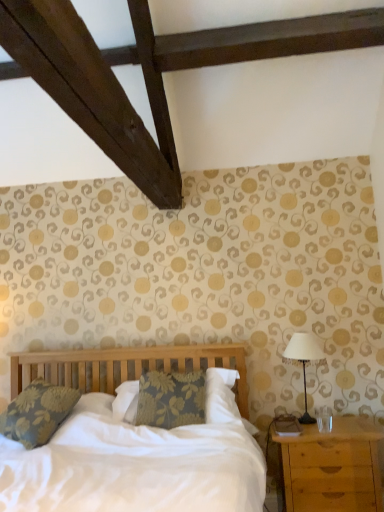
The height and width of the screenshot is (512, 384). What do you see at coordinates (37, 412) in the screenshot?
I see `floral fabric pillow at left` at bounding box center [37, 412].

What do you see at coordinates (332, 467) in the screenshot?
I see `light brown wooden nightstand at lower right` at bounding box center [332, 467].

Measure the distance between point [314,344] and camera.

They are 2.78 meters apart.

Identify the location of floral fabric pillow at left. (37, 412).

Considering the sizes of objects metallic silver table lamp at right and light brown wooden nightstand at lower right in the image provided, who is taller, metallic silver table lamp at right or light brown wooden nightstand at lower right?

light brown wooden nightstand at lower right is taller.

Considering the points (300, 361) and (341, 421), which point is behind, point (300, 361) or point (341, 421)?

Positioned behind is point (300, 361).

Find the location of a particular element. table lamp that appears above the light brown wooden nightstand at lower right (from the image's perspective) is located at coordinates pos(304,361).

From the image's perspective, which one is positioned lower, metallic silver table lamp at right or light brown wooden nightstand at lower right?

light brown wooden nightstand at lower right is shown below in the image.

Is light brown wooden nightstand at lower right located outside metallic silver table lamp at right?

Yes, light brown wooden nightstand at lower right is outside of metallic silver table lamp at right.

How different are the orientations of light brown wooden nightstand at lower right and metallic silver table lamp at right in degrees?

There is a 0.507-degree angle between the facing directions of light brown wooden nightstand at lower right and metallic silver table lamp at right.

From the image's perspective, who appears lower, light brown wooden nightstand at lower right or metallic silver table lamp at right?

light brown wooden nightstand at lower right.

Based on the photo, from a real-world perspective, is metallic silver table lamp at right over floral fabric pillow at left?

Yes, from a real-world perspective, metallic silver table lamp at right is on top of floral fabric pillow at left.

Considering the positions of points (295, 333) and (69, 408), is point (295, 333) closer to camera compared to point (69, 408)?

No, it is not.

Image resolution: width=384 pixels, height=512 pixels. What are the coordinates of `pillow on the left of metallic silver table lamp at right` in the screenshot? It's located at (37, 412).

From the image's perspective, between metallic silver table lamp at right and floral fabric pillow at left, which one is located above?

metallic silver table lamp at right appears higher in the image.

From a real-world perspective, is floral fabric pillow at left below metallic silver table lamp at right?

Indeed, from a real-world perspective, floral fabric pillow at left is positioned beneath metallic silver table lamp at right.

Find the location of a particular element. table lamp located above the floral fabric pillow at left (from a real-world perspective) is located at coordinates (304, 361).

Is floral fabric pillow at left facing towards metallic silver table lamp at right?

No, floral fabric pillow at left is not facing towards metallic silver table lamp at right.

Does floral fabric pillow at left lie behind metallic silver table lamp at right?

No, floral fabric pillow at left is closer to the camera.

Considering the sizes of floral fabric pillow at left and light brown wooden nightstand at lower right in the image, is floral fabric pillow at left bigger or smaller than light brown wooden nightstand at lower right?

Considering their sizes, floral fabric pillow at left takes up less space than light brown wooden nightstand at lower right.

Does point (48, 420) come behind point (377, 493)?

Yes, it is.

Is there a large distance between floral fabric pillow at left and light brown wooden nightstand at lower right?

Indeed, floral fabric pillow at left is not near light brown wooden nightstand at lower right.

From the image's perspective, is light brown wooden nightstand at lower right above or below floral fabric pillow at left?

From the image's perspective, light brown wooden nightstand at lower right appears below floral fabric pillow at left.

Is light brown wooden nightstand at lower right situated inside floral fabric pillow at left or outside?

light brown wooden nightstand at lower right is not enclosed by floral fabric pillow at left.

From a real-world perspective, does light brown wooden nightstand at lower right stand above floral fabric pillow at left?

No, from a real-world perspective, light brown wooden nightstand at lower right is not above floral fabric pillow at left.

Considering the positions of point (313, 494) and point (24, 406), is point (313, 494) closer or farther from the camera than point (24, 406)?

Point (313, 494).

Locate an element on the screen. The width and height of the screenshot is (384, 512). nightstand located in front of the metallic silver table lamp at right is located at coordinates (332, 467).

Locate an element on the screen. The image size is (384, 512). table lamp above the light brown wooden nightstand at lower right (from the image's perspective) is located at coordinates (304, 361).

Based on their spatial positions, is floral fabric pillow at left or metallic silver table lamp at right closer to light brown wooden nightstand at lower right?

metallic silver table lamp at right is positioned closer to the anchor light brown wooden nightstand at lower right.

Estimate the real-world distances between objects in this image. Which object is closer to metallic silver table lamp at right, floral fabric pillow at left or light brown wooden nightstand at lower right?

Among the two, light brown wooden nightstand at lower right is located nearer to metallic silver table lamp at right.

Based on their spatial positions, is light brown wooden nightstand at lower right or floral fabric pillow at left further from metallic silver table lamp at right?

floral fabric pillow at left is positioned further to the anchor metallic silver table lamp at right.

Based on their spatial positions, is metallic silver table lamp at right or light brown wooden nightstand at lower right closer to floral fabric pillow at left?

light brown wooden nightstand at lower right lies closer to floral fabric pillow at left than the other object.

Considering their positions, is light brown wooden nightstand at lower right positioned closer to floral fabric pillow at left than metallic silver table lamp at right?

light brown wooden nightstand at lower right is positioned closer to the anchor floral fabric pillow at left.

Considering their positions, is metallic silver table lamp at right positioned closer to light brown wooden nightstand at lower right than floral fabric pillow at left?

Among the two, metallic silver table lamp at right is located nearer to light brown wooden nightstand at lower right.

The image size is (384, 512). Find the location of `table lamp located between floral fabric pillow at left and light brown wooden nightstand at lower right in the left-right direction`. table lamp located between floral fabric pillow at left and light brown wooden nightstand at lower right in the left-right direction is located at coordinates (304, 361).